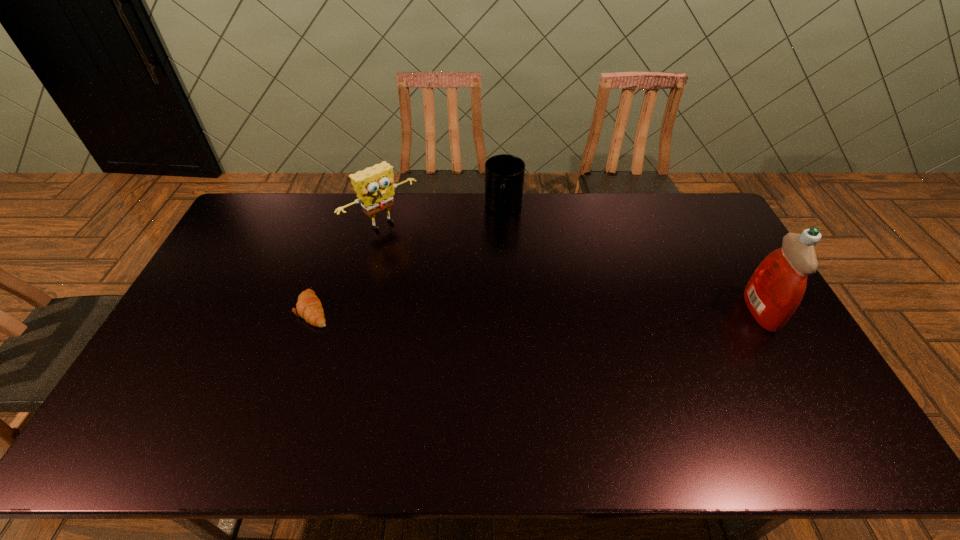
Where is `free space on the desktop that is between the crescent roll and the detergent and is positioned on the side of the mug with the handle`? Image resolution: width=960 pixels, height=540 pixels. free space on the desktop that is between the crescent roll and the detergent and is positioned on the side of the mug with the handle is located at coordinates (492, 310).

You are a GUI agent. You are given a task and a screenshot of the screen. Output one action in this format:
    pyautogui.click(x=<x>, y=<y>)
    Task: Click on the free spot on the desktop that is between the crescent roll and the detergent and is positioned on the face of the sponge
    The width and height of the screenshot is (960, 540).
    Given the screenshot: What is the action you would take?
    pyautogui.click(x=474, y=310)